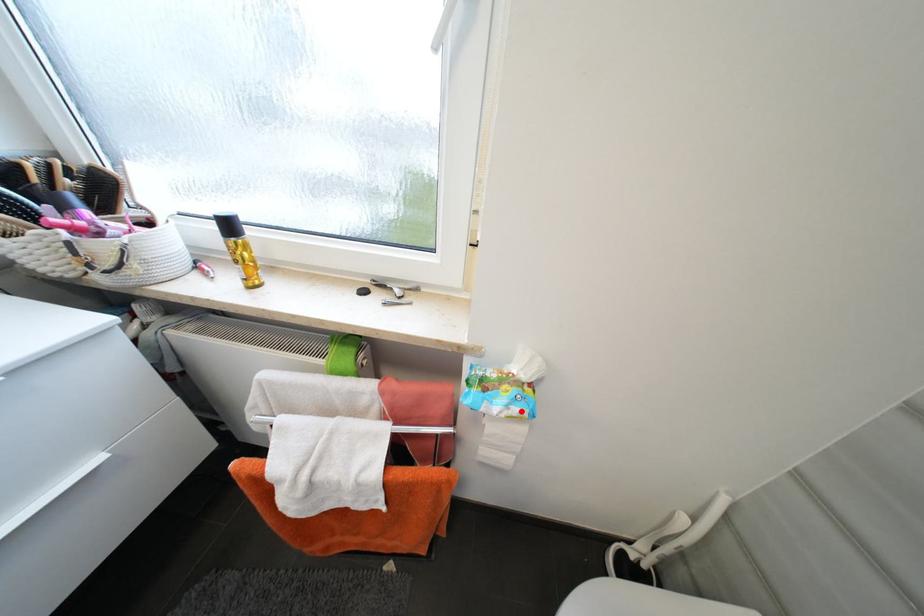
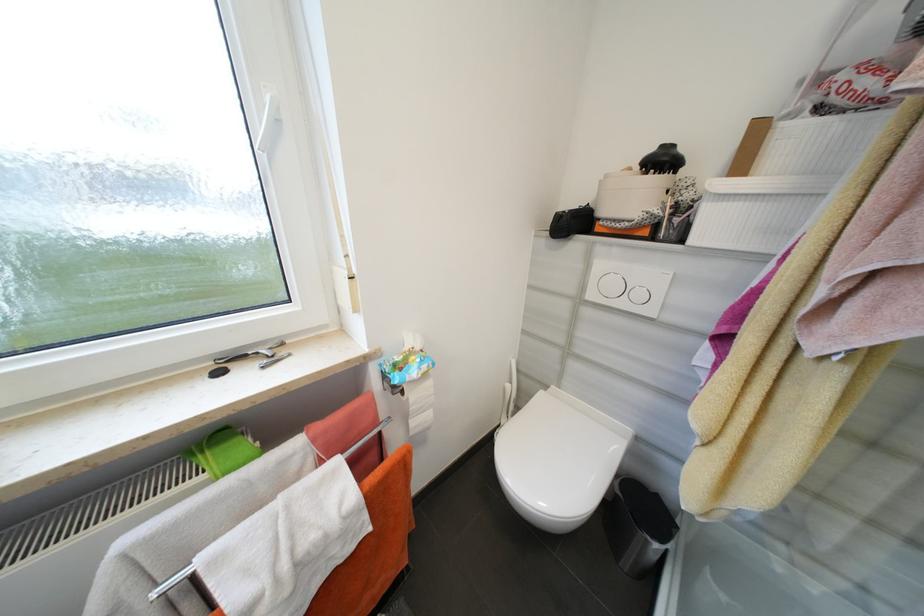
In the second image, find the point that corresponds to the highlighted location in the first image.

(430, 368)